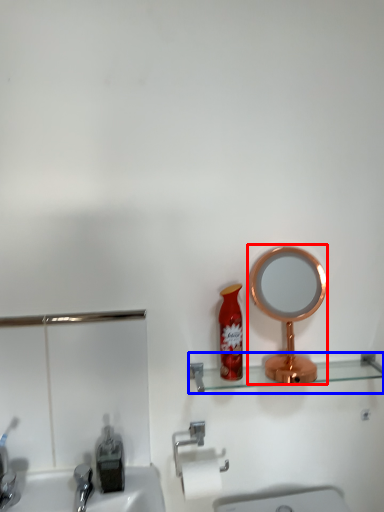
Question: Which object appears farthest to the camera in this image, mirror (highlighted by a red box) or shelve (highlighted by a blue box)?

Choices:
 (A) mirror
 (B) shelve

Answer: (B)